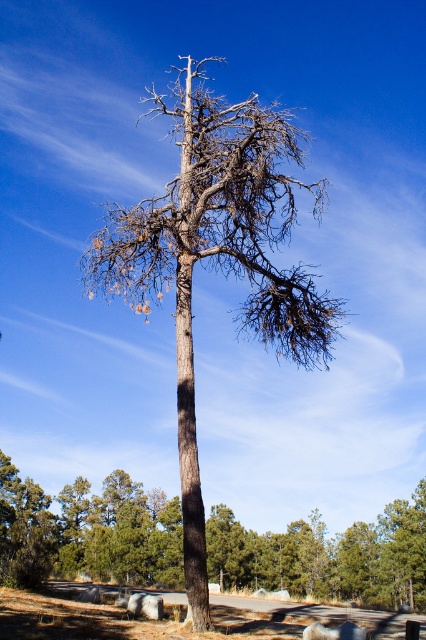
You are standing in front of the brown rough bark tree at center and want to take a photo of it. Your camera has a maximum focus range of 10 meters. Will the camera be able to focus on the tree?

The brown rough bark tree at center is 10.47 meters away from the camera. Since the camera can only focus up to 10 meters, it will not be able to focus on the tree.